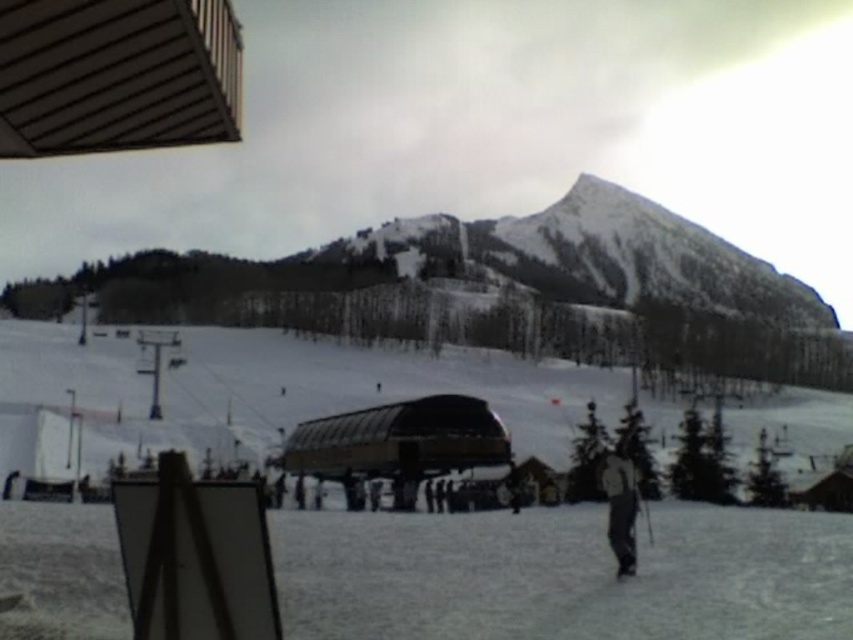
Consider the image. Is gray fabric jacket at lower right to the left of black matte ski at lower right from the viewer's perspective?

In fact, gray fabric jacket at lower right is to the right of black matte ski at lower right.

Does gray fabric jacket at lower right come in front of black matte ski at lower right?

No, it is not.

Who is more forward, (x=616, y=545) or (x=618, y=566)?

Point (x=618, y=566)

Identify the location of gray fabric jacket at lower right. (619, 508).

Based on the photo, can you confirm if white matte snow at center is positioned to the right of black matte ski at lower right?

No, white matte snow at center is not to the right of black matte ski at lower right.

Between point (782, 512) and point (625, 570), which one is positioned in front?

Positioned in front is point (625, 570).

Locate an element on the screen. white matte snow at center is located at coordinates (563, 576).

What do you see at coordinates (563, 576) in the screenshot? I see `white matte snow at center` at bounding box center [563, 576].

Is point (404, 541) in front of point (606, 467)?

No, it is not.

Describe the element at coordinates (563, 576) in the screenshot. The image size is (853, 640). I see `white matte snow at center` at that location.

At what (x,y) coordinates should I click in order to perform the action: click on white matte snow at center. Please return your answer as a coordinate pair (x, y). The height and width of the screenshot is (640, 853). Looking at the image, I should click on 563,576.